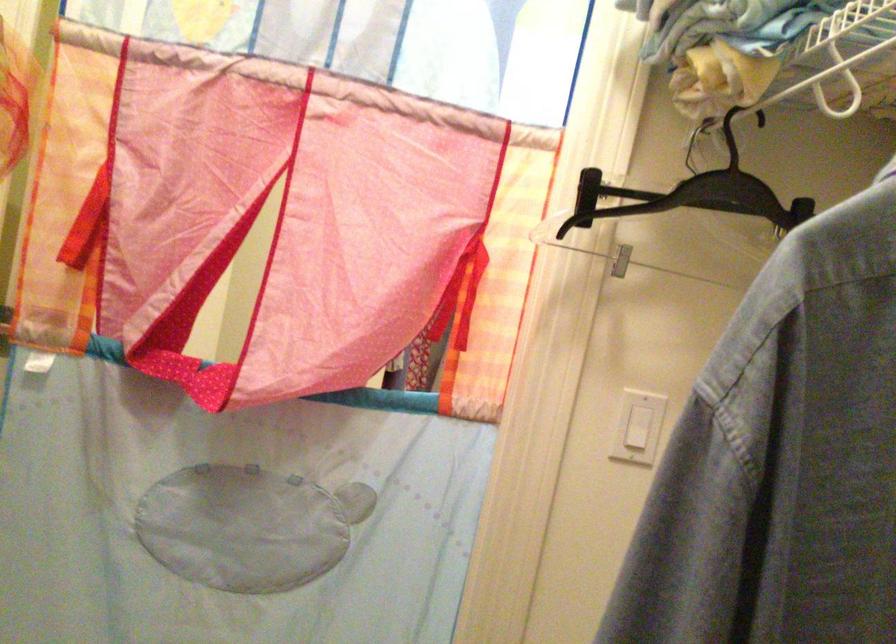
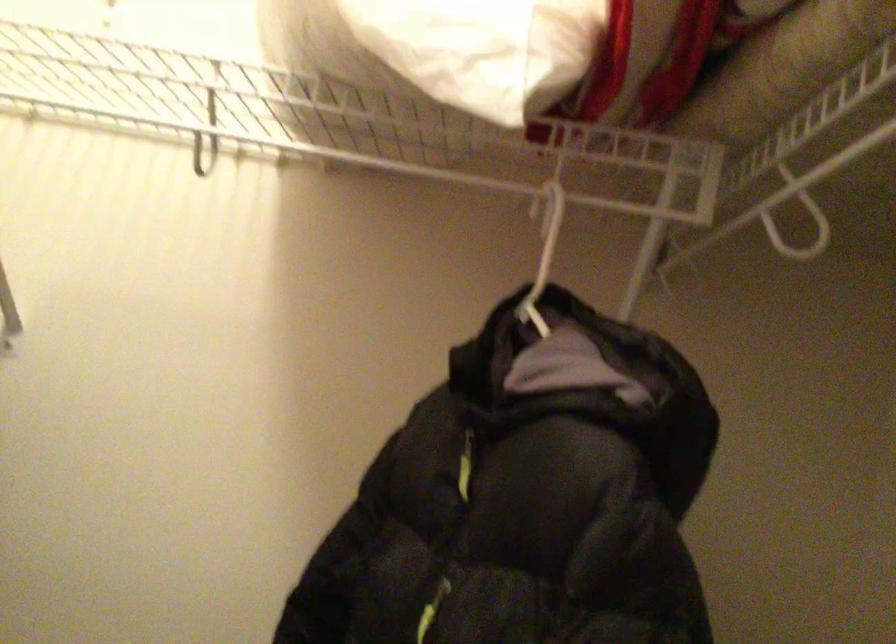
Question: The images are taken continuously from a first-person perspective. In which direction is your viewpoint rotating?

Choices:
 (A) Left
 (B) Right
 (C) Up
 (D) Down

Answer: (B)